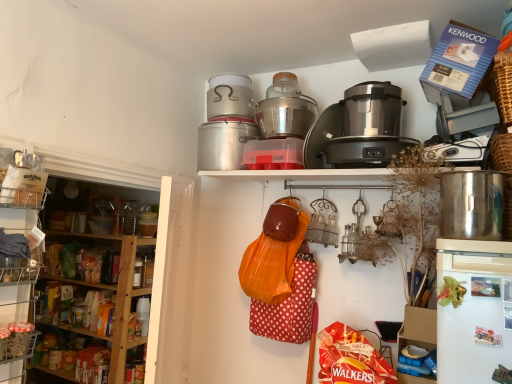
Locate an element on the screen. free space above wooden shelves at left, which ranks as the second shelf in right-to-left order (from a real-world perspective) is located at coordinates (108, 164).